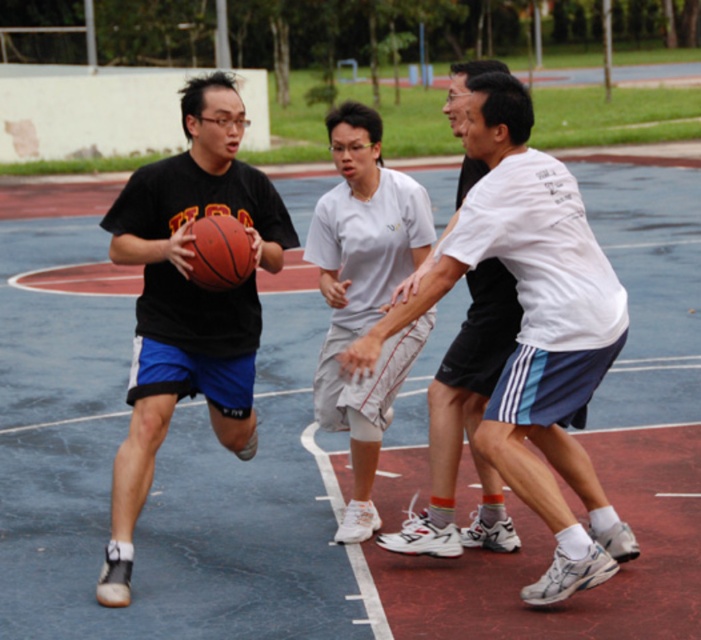
Question: Which object is farther from the camera taking this photo?

Choices:
 (A) matte black basketball at left
 (B) rubber textured basketball at left
 (C) white cotton shirt at center
 (D) white matte shorts at center

Answer: (D)

Question: Is white matte shorts at center further to the viewer compared to rubber textured basketball at center?

Choices:
 (A) yes
 (B) no

Answer: (A)

Question: Can you confirm if white cotton shirt at center is smaller than rubber textured basketball at center?

Choices:
 (A) no
 (B) yes

Answer: (A)

Question: Which of the following is the farthest from the observer?

Choices:
 (A) (456, 381)
 (B) (231, 358)
 (C) (191, 225)
 (D) (350, 259)

Answer: (D)

Question: Estimate the real-world distances between objects in this image. Which object is farther from the rubber textured basketball at center?

Choices:
 (A) white matte shorts at center
 (B) matte black basketball at left
 (C) rubber textured basketball at left
 (D) white cotton shirt at center

Answer: (A)

Question: Is rubber textured basketball at left further to the viewer compared to white cotton shirt at center?

Choices:
 (A) yes
 (B) no

Answer: (B)